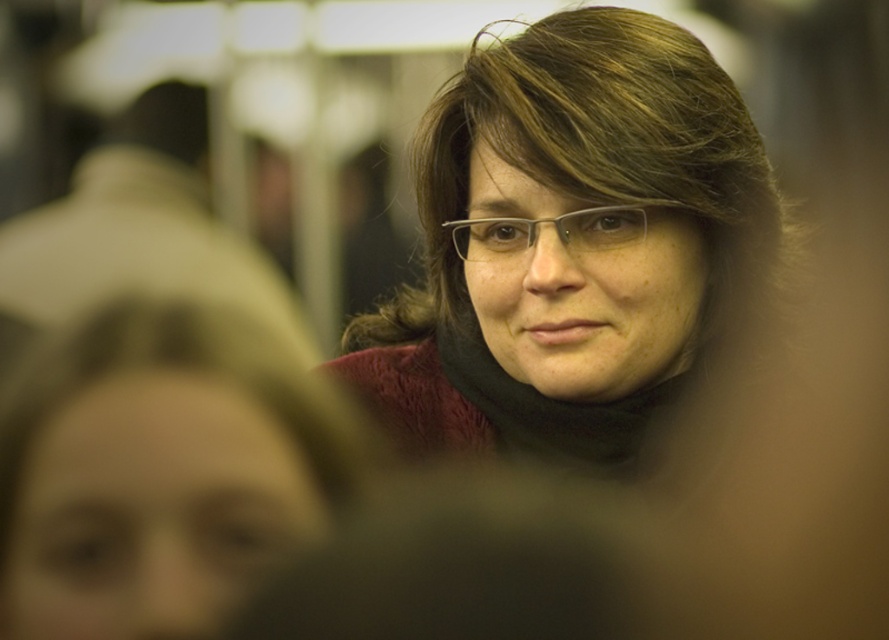
Question: Which of these objects is positioned farthest from the matte black scarf at center?

Choices:
 (A) matte black scarf at upper center
 (B) clear plastic glasses at center

Answer: (A)

Question: Which point is farther to the camera?

Choices:
 (A) matte black scarf at upper center
 (B) clear plastic glasses at center

Answer: (B)

Question: Is matte black scarf at center to the right of clear plastic glasses at center from the viewer's perspective?

Choices:
 (A) yes
 (B) no

Answer: (A)

Question: Which point appears closest to the camera in this image?

Choices:
 (A) pyautogui.click(x=316, y=381)
 (B) pyautogui.click(x=490, y=230)
 (C) pyautogui.click(x=661, y=282)

Answer: (A)

Question: Is matte black scarf at center thinner than clear plastic glasses at center?

Choices:
 (A) no
 (B) yes

Answer: (A)

Question: Does matte black scarf at center have a greater width compared to clear plastic glasses at center?

Choices:
 (A) no
 (B) yes

Answer: (B)